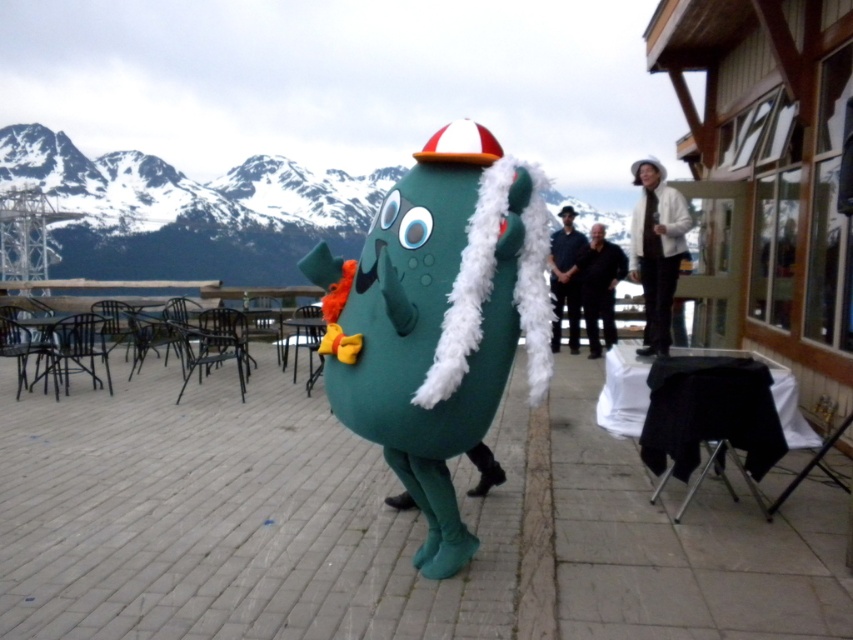
Does smooth concrete pavement at center come in front of black smooth pants at center?

Yes, it is in front of black smooth pants at center.

Who is shorter, smooth concrete pavement at center or black smooth pants at center?

smooth concrete pavement at center is shorter.

Between point (709, 620) and point (604, 317), which one is positioned behind?

The point (604, 317) is behind.

At what (x,y) coordinates should I click in order to perform the action: click on smooth concrete pavement at center. Please return your answer as a coordinate pair (x, y). This screenshot has width=853, height=640. Looking at the image, I should click on (682, 544).

Between point (13, 496) and point (643, 304), which one is positioned behind?

Positioned behind is point (643, 304).

From the picture: Who is more distant from viewer, (0, 499) or (645, 305)?

Point (645, 305)

Where is `green fabric costume at center`? The image size is (853, 640). green fabric costume at center is located at coordinates (230, 516).

Who is positioned more to the right, green fabric costume at center or black smooth pants at center?

black smooth pants at center

Between green fabric costume at center and black smooth pants at center, which one appears on the left side from the viewer's perspective?

From the viewer's perspective, green fabric costume at center appears more on the left side.

Where is `green fabric costume at center`? Image resolution: width=853 pixels, height=640 pixels. green fabric costume at center is located at coordinates (230, 516).

This screenshot has width=853, height=640. Find the location of `green fabric costume at center`. green fabric costume at center is located at coordinates (230, 516).